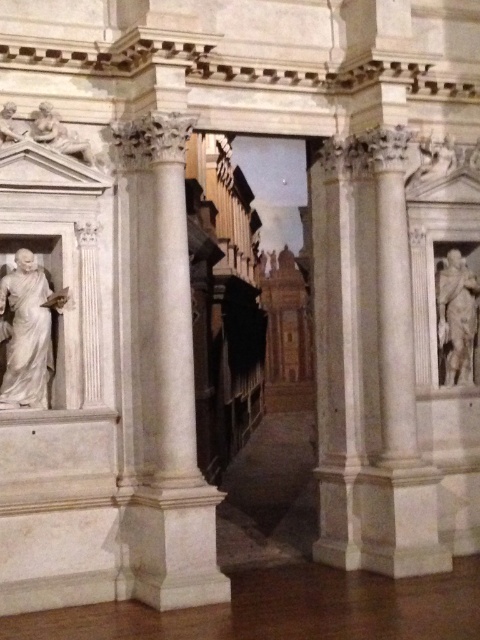
Question: Is white marble column at center closer to the viewer compared to white marble statue at right?

Choices:
 (A) no
 (B) yes

Answer: (B)

Question: Which object is positioned farthest from the white marble column at center?

Choices:
 (A) white marble statue at left
 (B) white marble statue at right

Answer: (B)

Question: Does white marble column at center have a larger size compared to white marble statue at right?

Choices:
 (A) no
 (B) yes

Answer: (B)

Question: Which point appears closest to the camera in this image?

Choices:
 (A) (15, 285)
 (B) (195, 564)

Answer: (B)

Question: Considering the real-world distances, which object is closest to the white marble column at center?

Choices:
 (A) white marble statue at right
 (B) white marble statue at left

Answer: (B)

Question: Is white marble statue at left closer to the viewer compared to white marble statue at right?

Choices:
 (A) no
 (B) yes

Answer: (B)